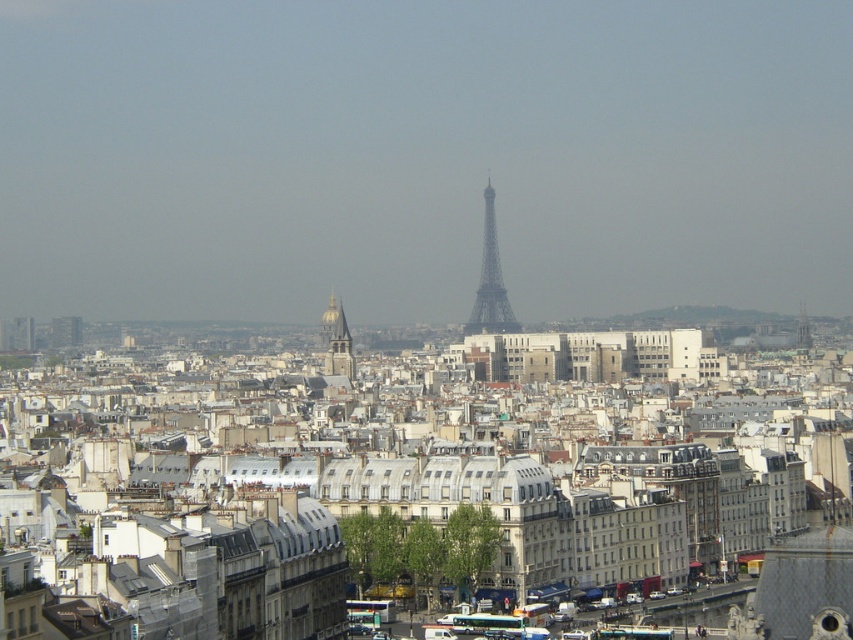
Where is `metallic structure at center`? This screenshot has height=640, width=853. metallic structure at center is located at coordinates click(x=490, y=282).

Does metallic structure at center have a greater width compared to goldmaterial/texturetower at center?

Yes, metallic structure at center is wider than goldmaterial/texturetower at center.

Between point (505, 314) and point (343, 332), which one is positioned in front?

Point (343, 332) is more forward.

Find the location of `metallic structure at center`. metallic structure at center is located at coordinates (490, 282).